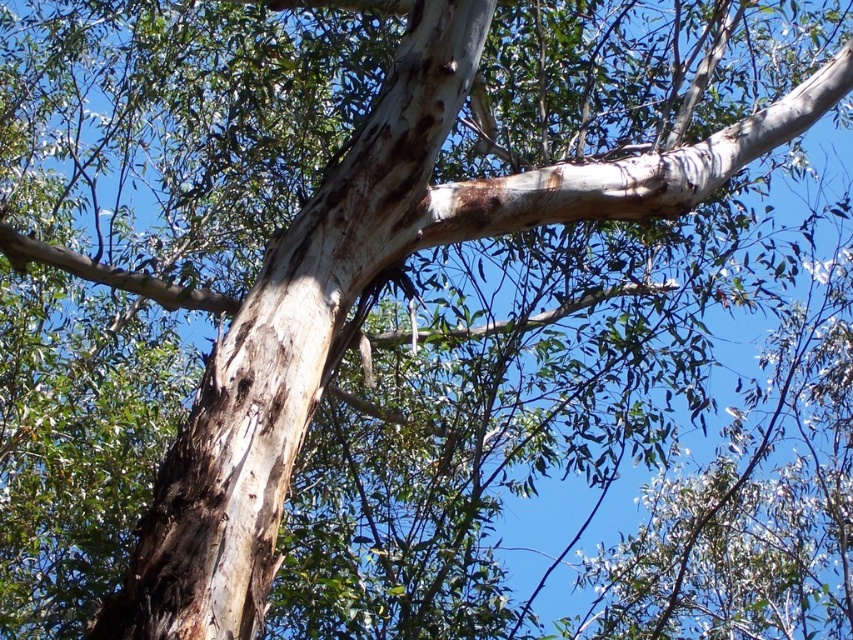
You are an arborist examining a eucalyptus tree. You notice two parts of the tree trunk and branches. The smooth white bark at center and the white rough bark branch at upper center. Which part is larger in size?

The white rough bark branch at upper center is larger than the smooth white bark at center.

You are an artist sketching the tree trunk and branches. You notice two areas of smooth bark. Which one is located to the right of the other? The smooth white bark at center and the smooth bark branch at upper center are both in your view. Can you determine their positions?

The smooth white bark at center is positioned on the right side of the smooth bark branch at upper center, so the smooth white bark at center is to the right of the smooth bark branch at upper center.